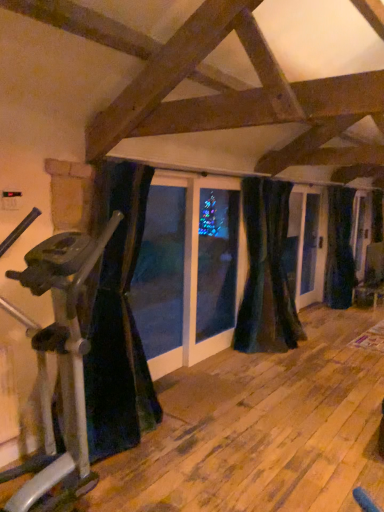
Where is `vacant region in front of velvet dark blue curtain at center, marked as the 2th curtain in a front-to-back arrangement`? This screenshot has height=512, width=384. vacant region in front of velvet dark blue curtain at center, marked as the 2th curtain in a front-to-back arrangement is located at coordinates (277, 369).